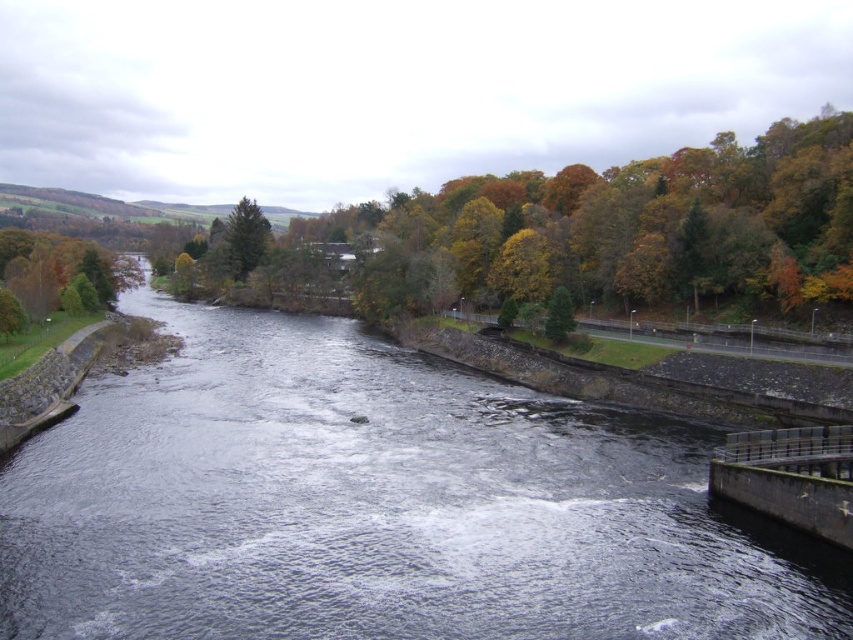
You are standing on the walkway along the river and notice two trees in the scene. Which tree, the green matte tree at left or the green matte tree at upper center, is positioned more to the left side of the image?

The green matte tree at left is positioned more to the left side of the image compared to the green matte tree at upper center.

From the picture: You are standing on the walkway next to the river and want to take a photo of both the dark gray water at center and the green matte tree at upper center. Which object will appear larger in your photo?

The dark gray water at center will appear larger in the photo because it is closer to the viewer than the green matte tree at upper center.

You are standing on the concrete embankment with the metal railing on the right side of the river. You want to throw a small pebble into the dark gray water at center. Based on the coordinates provided in the description, can you estimate the direction you need to throw the pebble to hit the water?

The dark gray water at center is located at point (378, 506), which would be slightly to the right and forward from your position on the embankment. Aim in that direction to hit the water.